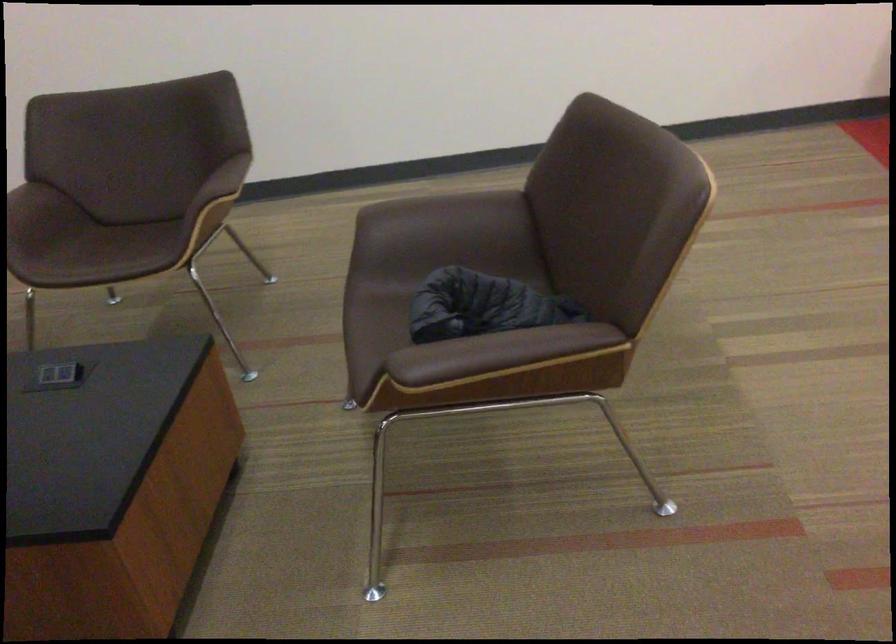
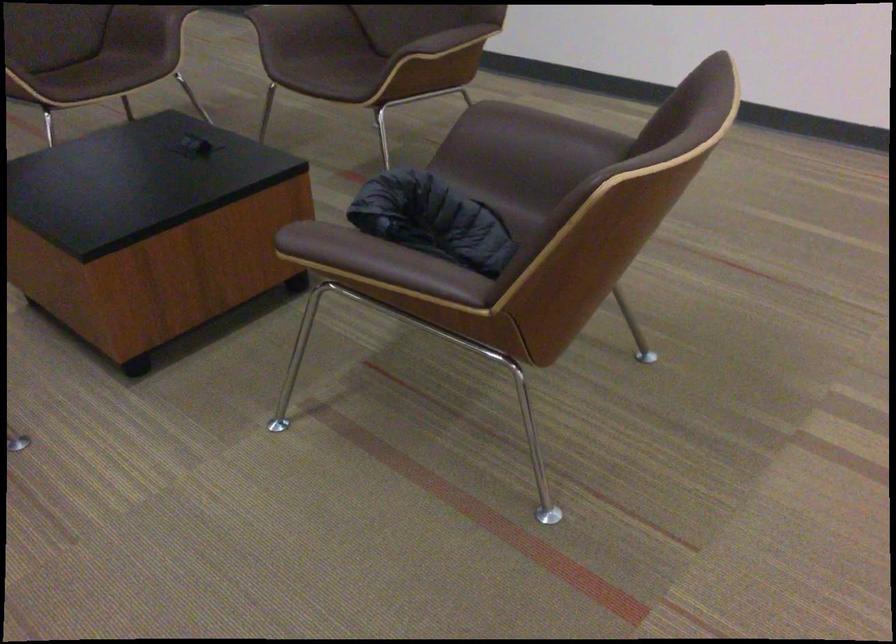
Find the pixel in the second image that matches the point at 446,205 in the first image.

(545, 128)